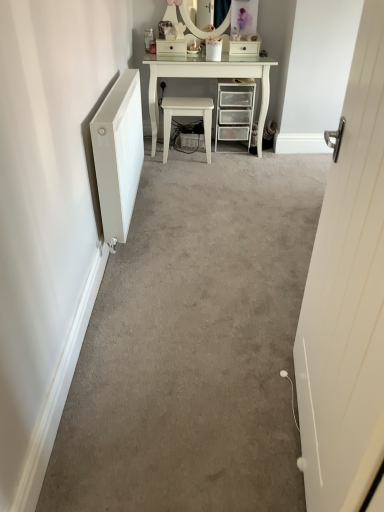
Locate an element on the screen. The height and width of the screenshot is (512, 384). vacant space in white glossy stool at center (from a real-world perspective) is located at coordinates point(187,158).